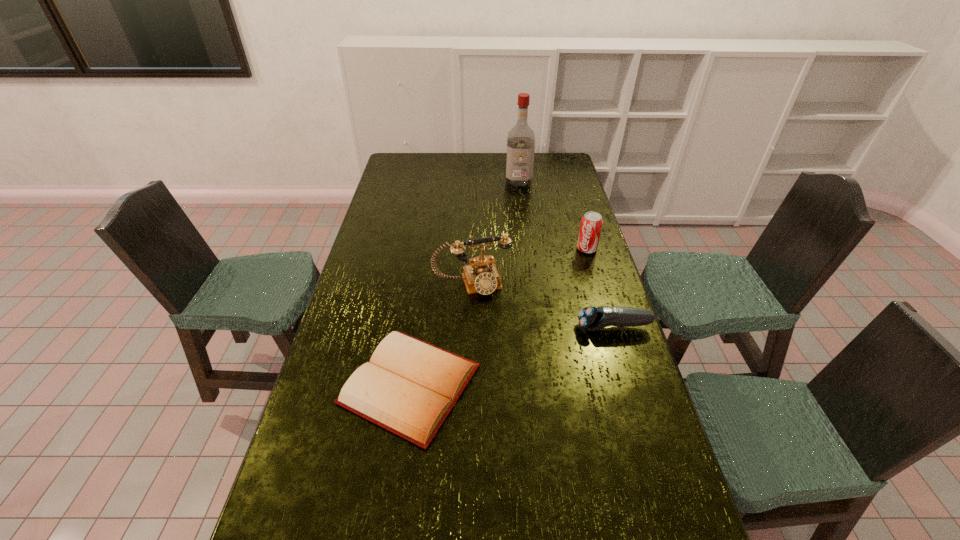
What are the coordinates of `vacant area situated 0.300m on the head of the electric shaver` in the screenshot? It's located at (484, 327).

Where is `vacant space situated 0.370m on the head of the electric shaver`? vacant space situated 0.370m on the head of the electric shaver is located at coordinates (462, 327).

Find the location of a particular element. The image size is (960, 540). free space located on the logo side of the soda can is located at coordinates (533, 311).

Locate an element on the screen. This screenshot has height=540, width=960. vacant area located on the logo side of the soda can is located at coordinates tap(536, 308).

Identify the location of free spot located on the logo side of the soda can. The height and width of the screenshot is (540, 960). (550, 292).

Where is `free space located on the dial number of the fourth shortest object`? free space located on the dial number of the fourth shortest object is located at coordinates (514, 389).

The image size is (960, 540). I want to click on free space located on the dial number of the fourth shortest object, so click(490, 321).

Find the location of a particular element. blank space located on the dial number of the fourth shortest object is located at coordinates (495, 336).

Locate an element on the screen. free space located 0.340m on the front-facing side of the liquor is located at coordinates (520, 230).

This screenshot has height=540, width=960. I want to click on vacant space located 0.310m on the front-facing side of the liquor, so click(x=520, y=225).